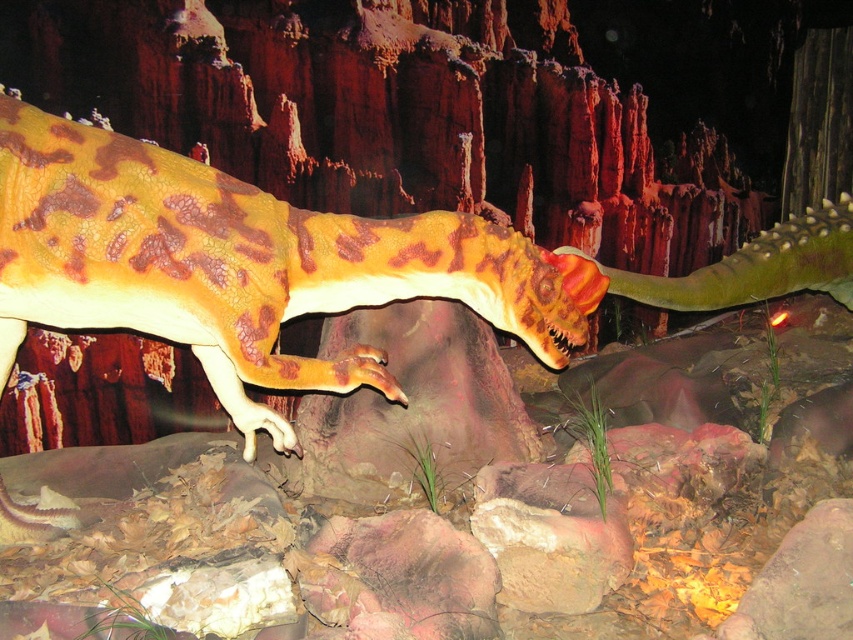
You are a museum guide explaining the exhibit to visitors. You want to mention the height comparison between the camouflage plastic dinosaur at center and the rustic stone at lower right. How would you phrase this without using specific measurements?

The camouflage plastic dinosaur at center stands taller than the rustic stone at lower right, creating a striking visual contrast between the prehistoric creature and the rocky terrain.

You are standing in a museum exhibit and see the camouflage plastic dinosaur at center. If you want to touch the dinosaur, will you be able to reach it from your current position?

The camouflage plastic dinosaur at center is 7.58 feet away from the viewer. Since the average arm length is about 2.5 feet, you cannot reach the dinosaur from your current position without moving closer.

You need to transport both the camouflage plastic dinosaur at center and the rustic stone at lower right using a truck bed that can only accommodate items up to 2 meters in width. Based on the scene description, can both items fit side by side without exceeding the truck bed width?

The camouflage plastic dinosaur at center might be wider than rustic stone at lower right. Since the exact width difference is not specified, it is uncertain if their combined width would exceed 2 meters. Further measurement is needed to confirm.